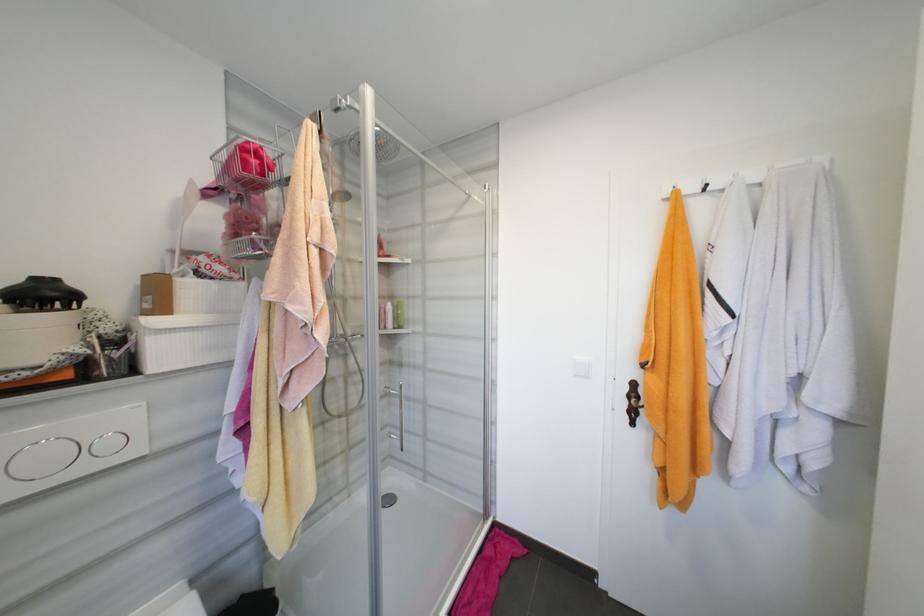
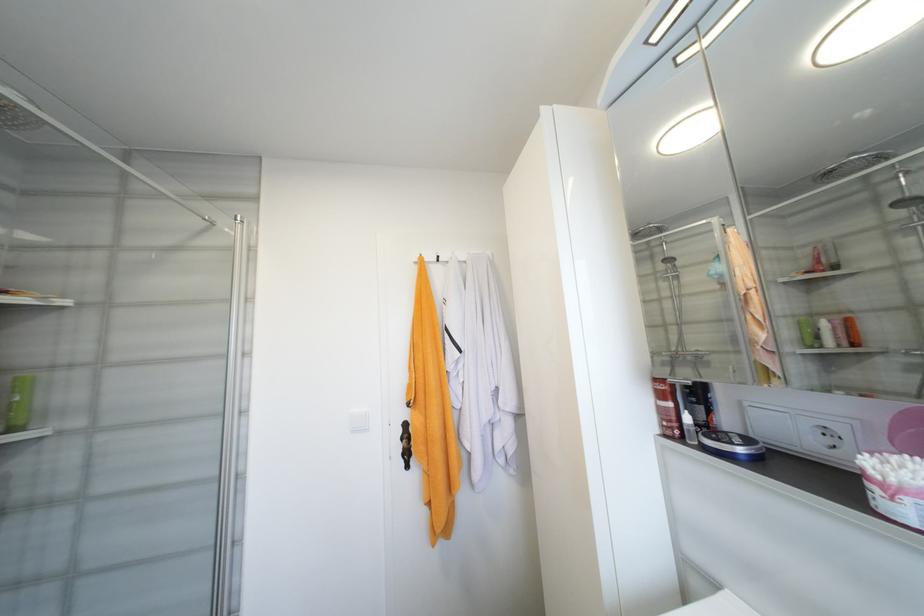
Locate, in the second image, the point that corresponds to the point at 629,405 in the first image.

(405, 448)